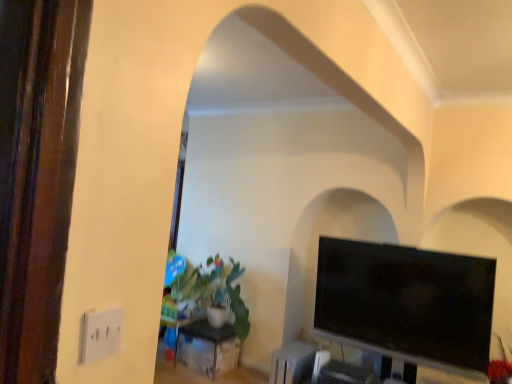
Question: From the image's perspective, is black glossy tv at right above or below black metal table at center?

Choices:
 (A) above
 (B) below

Answer: (A)

Question: Is point (327, 309) closer or farther from the camera than point (204, 319)?

Choices:
 (A) farther
 (B) closer

Answer: (B)

Question: Based on their relative distances, which object is nearer to the black glossy tv at right?

Choices:
 (A) black metal table at center
 (B) green matte plant at center-left

Answer: (B)

Question: Which object is positioned closest to the black metal table at center?

Choices:
 (A) green matte plant at center-left
 (B) black glossy tv at right

Answer: (A)